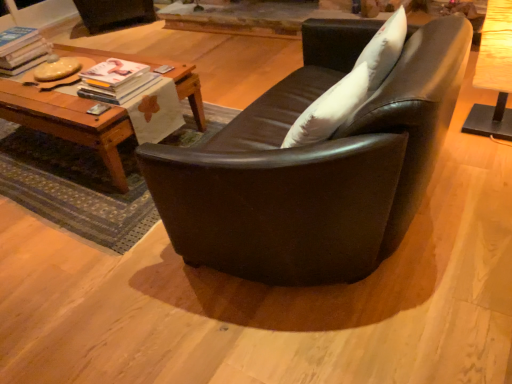
In order to click on wooden table at right, the 2th table viewed from the left in this screenshot , I will do `click(494, 73)`.

In order to face matte black couch at center, should I rotate leftwards or rightwards?

It's best to rotate right around 9.460 degrees.

The image size is (512, 384). Identify the location of matte white magazine at upper left, arranged as the first magazine when viewed from the left. (21, 49).

Locate an element on the screen. The width and height of the screenshot is (512, 384). matte white magazine at center left, the second magazine from the back is located at coordinates (116, 81).

This screenshot has width=512, height=384. What are the coordinates of `wooden table at right, the 2th table viewed from the left` in the screenshot? It's located at (494, 73).

Can you confirm if white soft pillow at upper right is taller than woodenwoodentable at left, which is the 1th table in left-to-right order?

No.

Does point (401, 29) come farther from viewer compared to point (128, 129)?

No.

Is white soft pillow at upper right facing away from woodenwoodentable at left, placed as the 2th table when sorted from right to left?

white soft pillow at upper right does not have its back to woodenwoodentable at left, placed as the 2th table when sorted from right to left.

Is white soft pillow at upper right inside the boundaries of woodenwoodentable at left, which is the 1th table in left-to-right order, or outside?

white soft pillow at upper right is outside woodenwoodentable at left, which is the 1th table in left-to-right order.

From a real-world perspective, which object stands above the other?

matte white magazine at center left, arranged as the second magazine when viewed from the left.

From the image's perspective, is wooden table at right, acting as the 1th table starting from the right, on matte white magazine at center left, the 1th magazine positioned from the bottom?

Yes, from the image's perspective, wooden table at right, acting as the 1th table starting from the right, is on top of matte white magazine at center left, the 1th magazine positioned from the bottom.

Looking at this image, is wooden table at right, the 2th table viewed from the left, at the left side of matte white magazine at center left, positioned as the second magazine in top-to-bottom order?

In fact, wooden table at right, the 2th table viewed from the left, is to the right of matte white magazine at center left, positioned as the second magazine in top-to-bottom order.

Would you say wooden table at right, the 2th table viewed from the left, is inside or outside matte white magazine at center left, arranged as the second magazine when viewed from the left?

wooden table at right, the 2th table viewed from the left, is spatially situated outside matte white magazine at center left, arranged as the second magazine when viewed from the left.

From the image's perspective, does matte white magazine at center left, arranged as the second magazine when viewed from the left, appear lower than matte black couch at center?

Incorrect, from the image's perspective, matte white magazine at center left, arranged as the second magazine when viewed from the left, is higher than matte black couch at center.

Considering the relative positions of matte white magazine at center left, acting as the 1th magazine starting from the right, and matte black couch at center in the image provided, is matte white magazine at center left, acting as the 1th magazine starting from the right, behind matte black couch at center?

Yes, the depth of matte white magazine at center left, acting as the 1th magazine starting from the right, is greater than that of matte black couch at center.

Does point (96, 92) appear closer or farther from the camera than point (433, 49)?

Point (96, 92) appears to be farther away from the viewer than point (433, 49).

From a real-world perspective, relative to matte black couch at center, is matte white magazine at center left, arranged as the second magazine when viewed from the left, vertically above or below?

In terms of real-world spatial position, matte white magazine at center left, arranged as the second magazine when viewed from the left, is above matte black couch at center.

Is matte white magazine at upper left, placed as the second magazine when sorted from right to left, completely or partially outside of white soft pillow at upper right?

matte white magazine at upper left, placed as the second magazine when sorted from right to left, is positioned outside white soft pillow at upper right.

The height and width of the screenshot is (384, 512). Find the location of `pillow on the right of matte white magazine at upper left, the 1th magazine when ordered from top to bottom`. pillow on the right of matte white magazine at upper left, the 1th magazine when ordered from top to bottom is located at coordinates (384, 49).

From the picture: Considering the relative positions of matte white magazine at upper left, placed as the second magazine when sorted from right to left, and white soft pillow at upper right in the image provided, is matte white magazine at upper left, placed as the second magazine when sorted from right to left, to the left of white soft pillow at upper right from the viewer's perspective?

Yes, matte white magazine at upper left, placed as the second magazine when sorted from right to left, is to the left of white soft pillow at upper right.

Is matte white magazine at upper left, arranged as the first magazine when viewed from the left, far from white soft pillow at upper right?

Yes, matte white magazine at upper left, arranged as the first magazine when viewed from the left, is far from white soft pillow at upper right.

Is matte black couch at center aimed at woodenwoodentable at left, placed as the 2th table when sorted from right to left?

Yes, matte black couch at center is aimed at woodenwoodentable at left, placed as the 2th table when sorted from right to left.

Considering their positions, is matte black couch at center located in front of or behind woodenwoodentable at left, which is the 1th table in left-to-right order?

Clearly, matte black couch at center is in front of woodenwoodentable at left, which is the 1th table in left-to-right order.

Measure the distance between matte black couch at center and woodenwoodentable at left, placed as the 2th table when sorted from right to left.

matte black couch at center is 1.00 meters away from woodenwoodentable at left, placed as the 2th table when sorted from right to left.

From a real-world perspective, does matte black couch at center stand above woodenwoodentable at left, which is the 1th table in left-to-right order?

Yes, from a real-world perspective, matte black couch at center is over woodenwoodentable at left, which is the 1th table in left-to-right order

This screenshot has height=384, width=512. I want to click on the 1st table below when counting from the matte white magazine at upper left, which is counted as the 2th magazine, starting from the front (from the image's perspective), so click(494, 73).

Is matte white magazine at upper left, arranged as the first magazine when viewed from the left, positioned with its back to wooden table at right, the 2th table viewed from the left?

No.

Which of these two, matte white magazine at upper left, placed as the second magazine when sorted from right to left, or wooden table at right, acting as the 1th table starting from the right, is smaller?

matte white magazine at upper left, placed as the second magazine when sorted from right to left.

Measure the distance between woodenwoodentable at left, which is the 1th table in left-to-right order, and wooden table at right, the 2th table viewed from the left.

woodenwoodentable at left, which is the 1th table in left-to-right order, is 1.88 meters away from wooden table at right, the 2th table viewed from the left.

Is woodenwoodentable at left, which is the 1th table in left-to-right order, completely or partially outside of wooden table at right, acting as the 1th table starting from the right?

Yes, woodenwoodentable at left, which is the 1th table in left-to-right order, is outside of wooden table at right, acting as the 1th table starting from the right.

Considering the positions of objects woodenwoodentable at left, placed as the 2th table when sorted from right to left, and wooden table at right, the 2th table viewed from the left, in the image provided, who is more to the right, woodenwoodentable at left, placed as the 2th table when sorted from right to left, or wooden table at right, the 2th table viewed from the left,?

wooden table at right, the 2th table viewed from the left, is more to the right.

Considering the sizes of objects woodenwoodentable at left, which is the 1th table in left-to-right order, and wooden table at right, acting as the 1th table starting from the right, in the image provided, who is wider, woodenwoodentable at left, which is the 1th table in left-to-right order, or wooden table at right, acting as the 1th table starting from the right,?

Wider between the two is woodenwoodentable at left, which is the 1th table in left-to-right order.

Identify the location of table to the left of white soft pillow at upper right. This screenshot has width=512, height=384. (69, 122).

Identify the location of table that is the 1st object directly below the matte white magazine at center left, positioned as the second magazine in top-to-bottom order (from a real-world perspective). (494, 73).

Based on their spatial positions, is matte black couch at center or wooden table at right, the 2th table viewed from the left, closer to woodenwoodentable at left, which is the 1th table in left-to-right order?

Among the two, matte black couch at center is located nearer to woodenwoodentable at left, which is the 1th table in left-to-right order.

When comparing their distances from woodenwoodentable at left, which is the 1th table in left-to-right order, does white soft pillow at upper right or matte white magazine at upper left, placed as the second magazine when sorted from right to left, seem further?

The object further to woodenwoodentable at left, which is the 1th table in left-to-right order, is white soft pillow at upper right.

Based on their spatial positions, is white soft pillow at upper right or matte white magazine at upper left, arranged as the first magazine when viewed from the left, further from matte white magazine at center left, arranged as the second magazine when viewed from the left?

white soft pillow at upper right.

Looking at the image, which one is located further to white soft pillow at upper right, matte black couch at center or matte white magazine at center left, arranged as the second magazine when viewed from the left?

matte white magazine at center left, arranged as the second magazine when viewed from the left, lies further to white soft pillow at upper right than the other object.

Considering their positions, is matte white magazine at upper left, placed as the first magazine when sorted from back to front, positioned further to white soft pillow at upper right than wooden table at right, the 2th table viewed from the left?

matte white magazine at upper left, placed as the first magazine when sorted from back to front, is positioned further to the anchor white soft pillow at upper right.

From the picture: Based on their spatial positions, is matte black couch at center or matte white magazine at upper left, placed as the first magazine when sorted from back to front, further from wooden table at right, the 2th table viewed from the left?

matte white magazine at upper left, placed as the first magazine when sorted from back to front, is further to wooden table at right, the 2th table viewed from the left.

When comparing their distances from matte white magazine at upper left, arranged as the first magazine when viewed from the left, does matte black couch at center or matte white magazine at center left, arranged as the second magazine when viewed from the left, seem closer?

Among the two, matte white magazine at center left, arranged as the second magazine when viewed from the left, is located nearer to matte white magazine at upper left, arranged as the first magazine when viewed from the left.

Considering their positions, is matte black couch at center positioned further to matte white magazine at center left, which ranks as the first magazine in front-to-back order, than matte white magazine at upper left, arranged as the first magazine when viewed from the left?

Among the two, matte black couch at center is located further to matte white magazine at center left, which ranks as the first magazine in front-to-back order.

I want to click on magazine between woodenwoodentable at left, which is the 1th table in left-to-right order, and matte black couch at center, so 116,81.

Where is `table situated between matte white magazine at upper left, placed as the second magazine when sorted from right to left, and matte white magazine at center left, acting as the 1th magazine starting from the right, from left to right`? The height and width of the screenshot is (384, 512). table situated between matte white magazine at upper left, placed as the second magazine when sorted from right to left, and matte white magazine at center left, acting as the 1th magazine starting from the right, from left to right is located at coordinates point(69,122).

This screenshot has width=512, height=384. I want to click on table between matte white magazine at upper left, the 1th magazine when ordered from top to bottom, and matte black couch at center from left to right, so click(69, 122).

I want to click on studio couch between woodenwoodentable at left, placed as the 2th table when sorted from right to left, and wooden table at right, acting as the 1th table starting from the right, from left to right, so click(x=315, y=165).